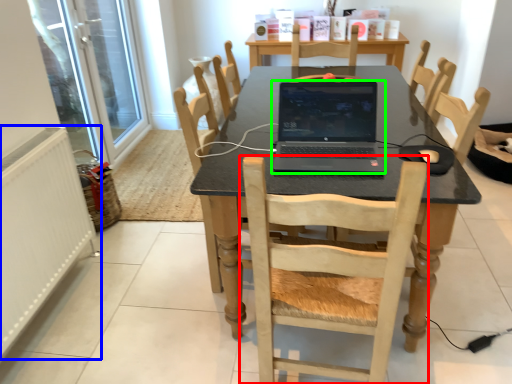
Question: Estimate the real-world distances between objects in this image. Which object is closer to chair (highlighted by a red box), radiator (highlighted by a blue box) or laptop (highlighted by a green box)?

Choices:
 (A) radiator
 (B) laptop

Answer: (B)